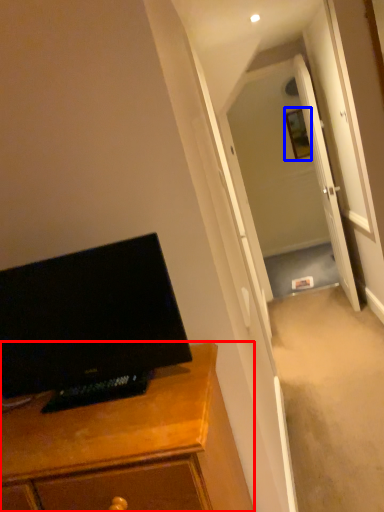
Question: Which of the following is the closest to the observer, cabinetry (highlighted by a red box) or picture frame (highlighted by a blue box)?

Choices:
 (A) cabinetry
 (B) picture frame

Answer: (A)